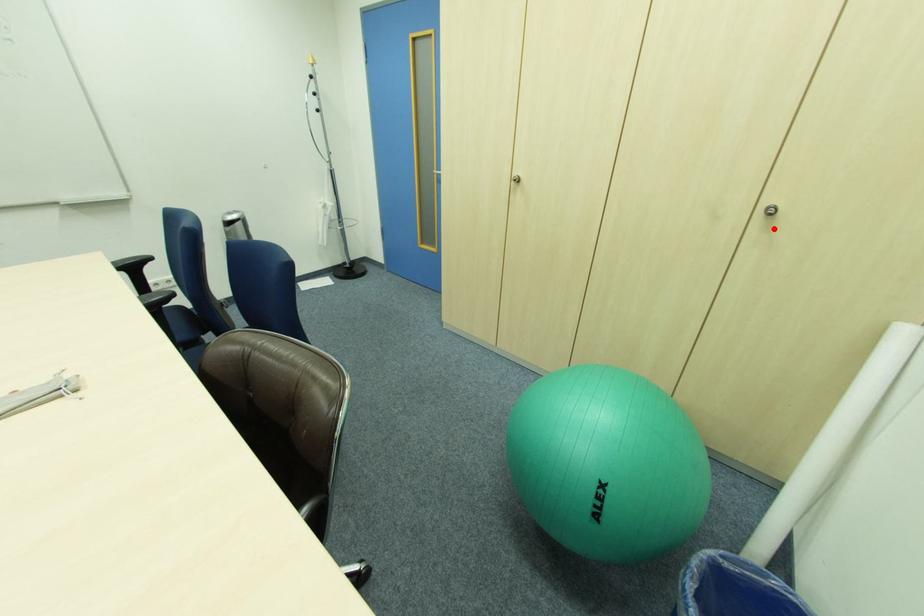
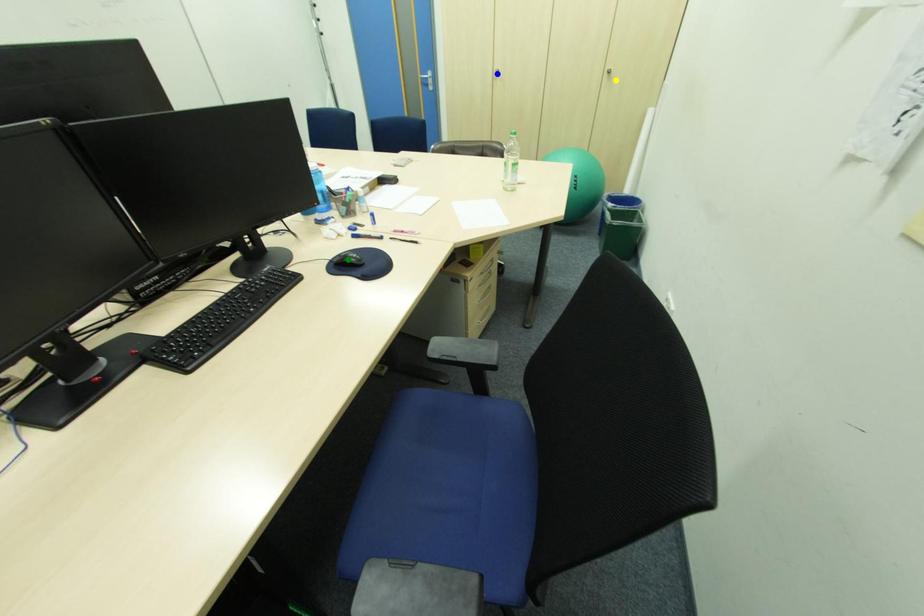
Question: I am providing you with two images of the same scene from different viewpoints. A red point is marked on the first image. You are given multiple points on the second image. Can you choose the point in image 2 that corresponds to the point in image 1?

Choices:
 (A) blue point
 (B) yellow point
 (C) green point

Answer: (B)